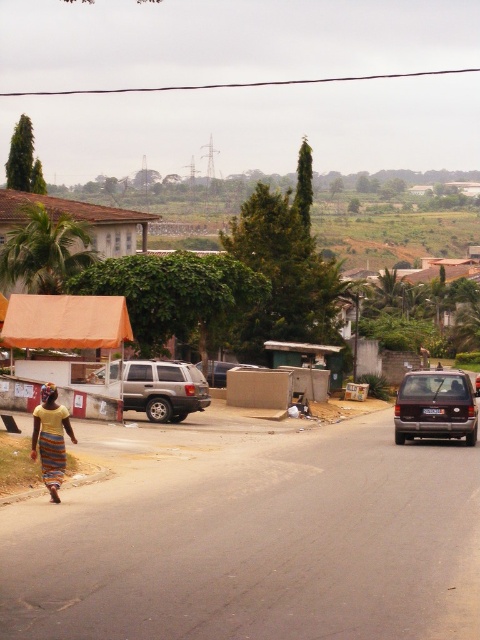
Is satin brown van at right behind striped cotton dress at lower left?

Yes, satin brown van at right is behind striped cotton dress at lower left.

Who is shorter, satin brown van at right or striped cotton dress at lower left?

striped cotton dress at lower left

Is point (435, 384) farther from viewer compared to point (47, 436)?

Yes, it is behind point (47, 436).

Locate an element on the screen. This screenshot has width=480, height=640. satin brown van at right is located at coordinates click(435, 406).

The image size is (480, 640). In order to click on satin brown van at right in this screenshot , I will do `click(435, 406)`.

Between striped fabric dress at lower left and striped cotton dress at lower left, which one appears on the left side from the viewer's perspective?

From the viewer's perspective, striped cotton dress at lower left appears more on the left side.

The height and width of the screenshot is (640, 480). What are the coordinates of `striped fabric dress at lower left` in the screenshot? It's located at (50, 438).

The image size is (480, 640). In order to click on striped fabric dress at lower left in this screenshot , I will do `click(50, 438)`.